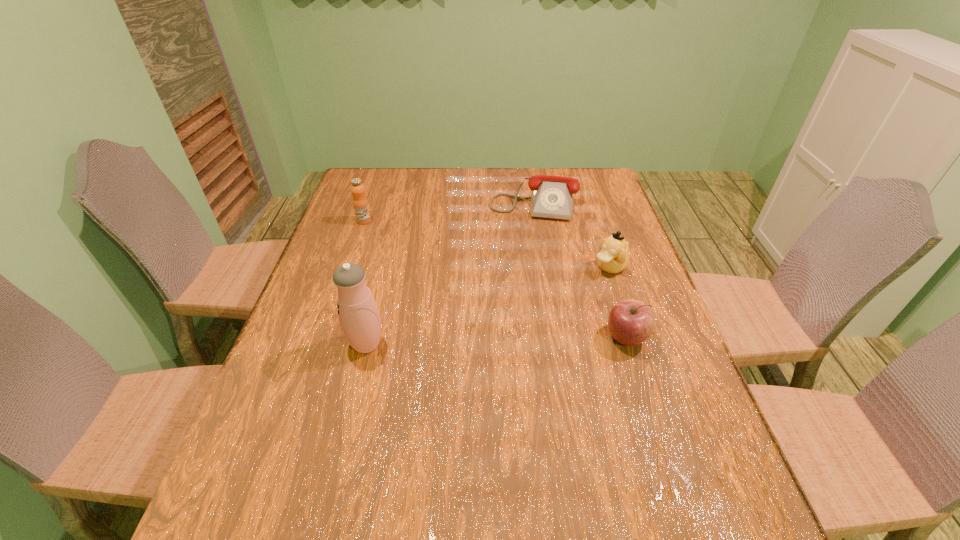
Where is `vacant area situated 0.080m on the face of the duckling`? vacant area situated 0.080m on the face of the duckling is located at coordinates (578, 286).

Locate an element on the screen. The image size is (960, 540). free space located on the face of the duckling is located at coordinates (539, 312).

Where is `vacant space situated on the dial of the shortest object`? This screenshot has width=960, height=540. vacant space situated on the dial of the shortest object is located at coordinates (x=521, y=271).

I want to click on vacant space positioned 0.380m on the dial of the shortest object, so click(516, 306).

Identify the location of vacant space located 0.110m on the dial of the shortest object. (525, 243).

The height and width of the screenshot is (540, 960). I want to click on free space located on the front label of the orange juice, so click(402, 249).

The height and width of the screenshot is (540, 960). In order to click on free space located 0.200m on the front label of the orange juice in this screenshot , I will do `click(406, 252)`.

Find the location of `free spot located 0.330m on the front label of the orange juice`. free spot located 0.330m on the front label of the orange juice is located at coordinates (435, 273).

This screenshot has width=960, height=540. What are the coordinates of `object located at the far edge` in the screenshot? It's located at (552, 197).

Identify the location of thermos bottle that is at the left edge. The height and width of the screenshot is (540, 960). (358, 314).